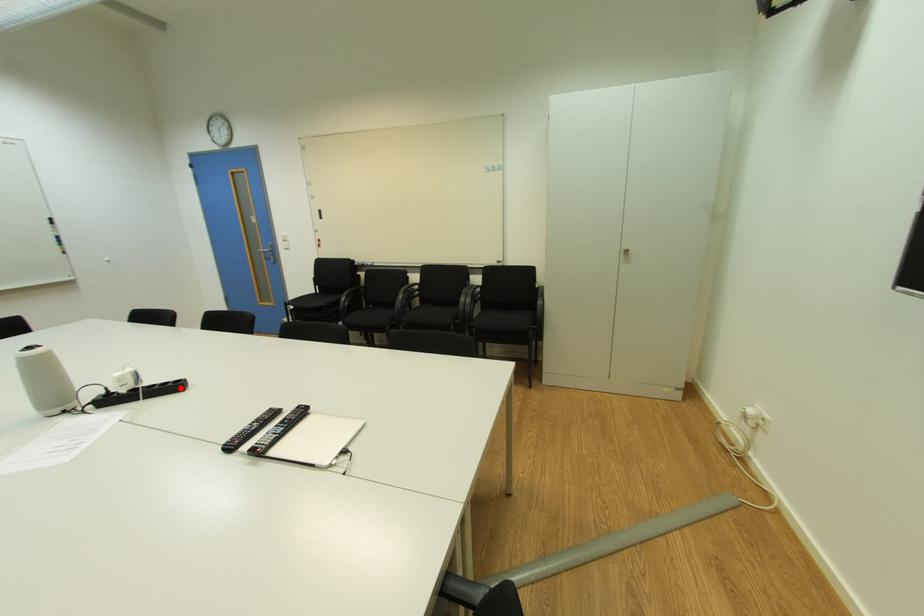
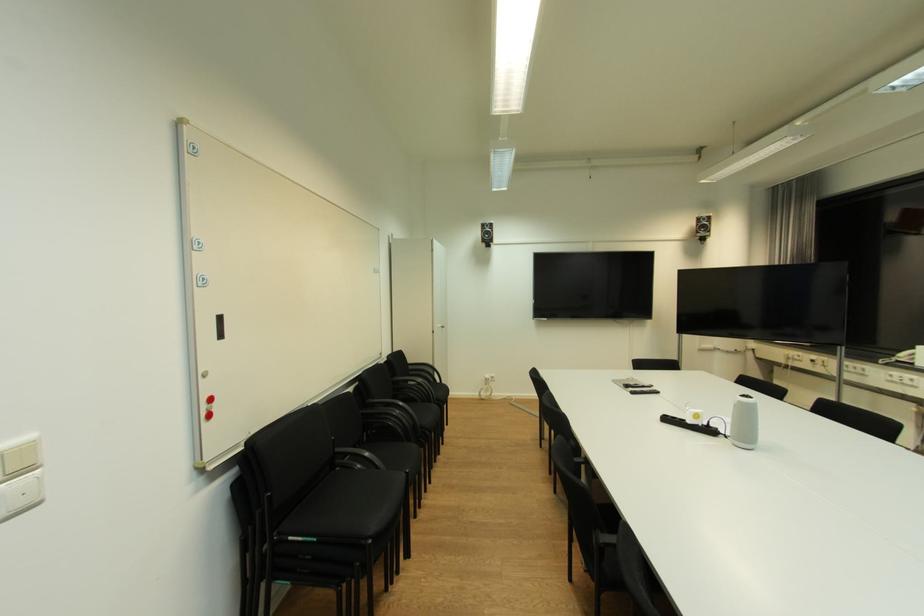
Question: I am providing you with two images of the same scene from different viewpoints. A red point is marked on the first image. Can you still see the location of the red point in image 2?

Choices:
 (A) Yes
 (B) No

Answer: (A)